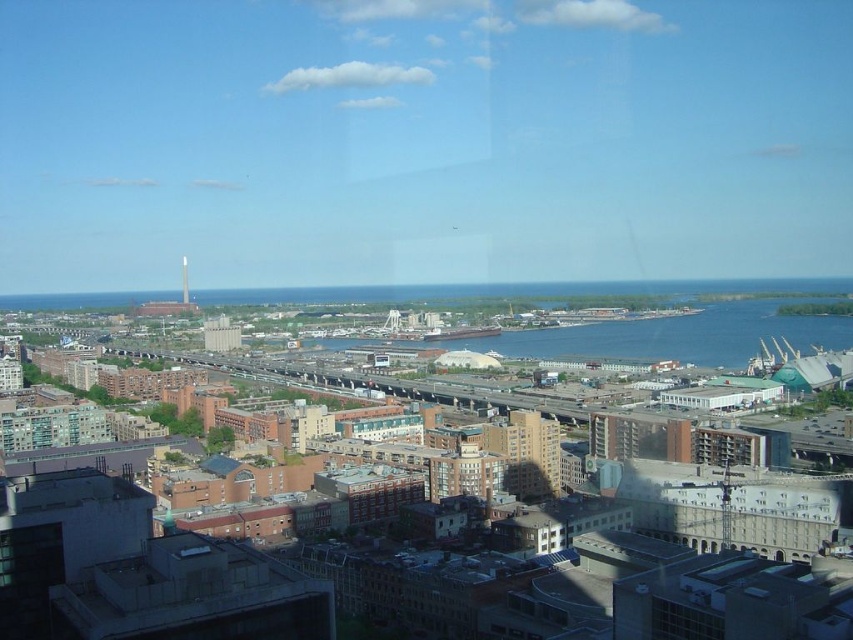
Where is `beige concrete building at center`? The height and width of the screenshot is (640, 853). beige concrete building at center is located at coordinates 531,456.

Who is higher up, beige concrete building at center or white glossy tower at center?

white glossy tower at center is higher up.

This screenshot has height=640, width=853. Identify the location of beige concrete building at center. (531, 456).